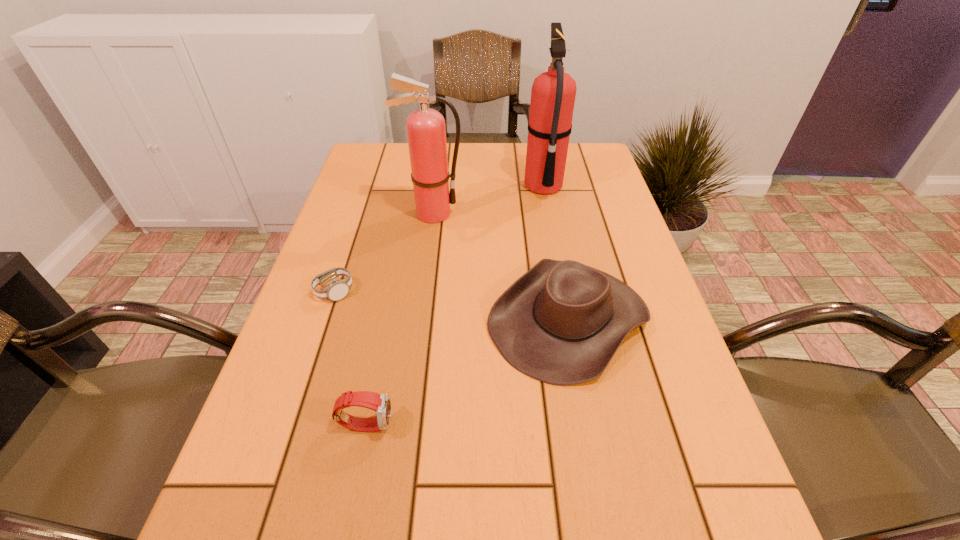
Locate an element on the screen. The image size is (960, 540). vacant space located 0.220m on the hose direction of the left fire extinguisher is located at coordinates 543,213.

I want to click on vacant space located on the back of the third shortest object, so click(554, 247).

At what (x,y) coordinates should I click in order to perform the action: click on vacant space located 0.290m on the face of the nearer watch. Please return your answer as a coordinate pair (x, y). Looking at the image, I should click on (561, 424).

The width and height of the screenshot is (960, 540). I want to click on vacant space located 0.400m on the face of the shortest object, so click(x=531, y=292).

Locate an element on the screen. The height and width of the screenshot is (540, 960). object that is at the far edge is located at coordinates (637, 539).

Find the location of a particular element. Image resolution: width=960 pixels, height=540 pixels. fire extinguisher at the right edge is located at coordinates (637, 539).

This screenshot has height=540, width=960. What are the coordinates of `cowboy hat at the right edge` in the screenshot? It's located at (577, 539).

At what (x,y) coordinates should I click in order to perform the action: click on object that is at the far right corner. Please return your answer as a coordinate pair (x, y). The image size is (960, 540). Looking at the image, I should click on tap(637, 539).

Where is `object that is the fourth closest to the left fire extinguisher`? The width and height of the screenshot is (960, 540). object that is the fourth closest to the left fire extinguisher is located at coordinates (637, 539).

Identify which object is located as the fourth nearest to the nearer watch. Please provide its 2D coordinates. Your answer should be formatted as a tuple, i.e. [(x, y)], where the tuple contains the x and y coordinates of a point satisfying the conditions above.

[(637, 539)]